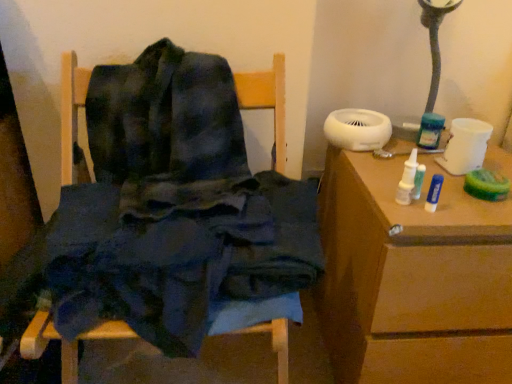
Locate an element on the screen. free space above brown wooden table at right (from a real-world perspective) is located at coordinates (418, 161).